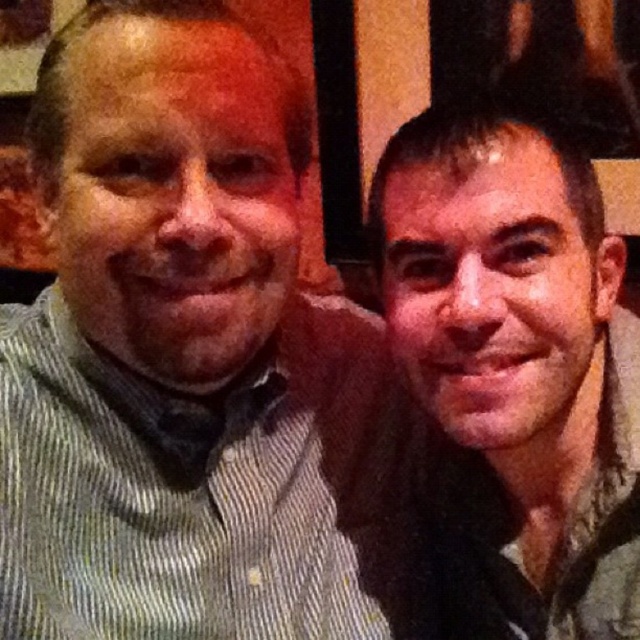
Question: Is the position of striped cotton shirt at left less distant than that of matte gray scarf at right?

Choices:
 (A) no
 (B) yes

Answer: (B)

Question: Among these points, which one is farthest from the camera?

Choices:
 (A) (307, 560)
 (B) (579, 472)

Answer: (A)

Question: Which object is farther from the camera taking this photo?

Choices:
 (A) matte gray scarf at right
 (B) striped cotton shirt at left

Answer: (A)

Question: Does striped cotton shirt at left appear under matte gray scarf at right?

Choices:
 (A) yes
 (B) no

Answer: (B)

Question: Where is striped cotton shirt at left located in relation to matte gray scarf at right in the image?

Choices:
 (A) left
 (B) right

Answer: (A)